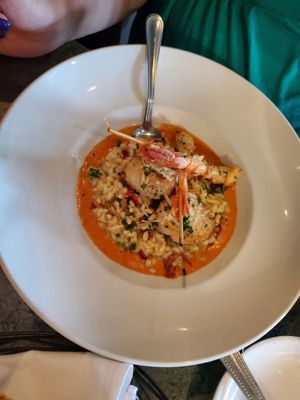
Locate an element on the screen. silverware is located at coordinates (236, 369), (155, 44).